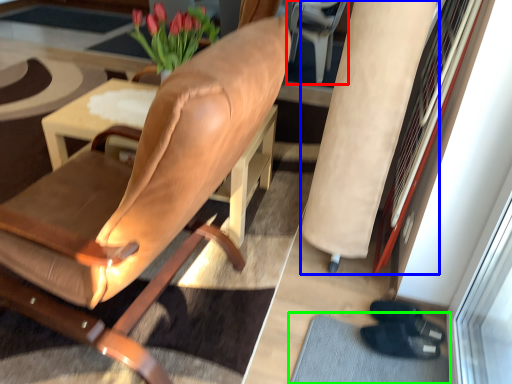
Question: Estimate the real-world distances between objects in this image. Which object is closer to armchair (highlighted by a red box), beige (highlighted by a blue box) or doormat (highlighted by a green box)?

Choices:
 (A) beige
 (B) doormat

Answer: (A)